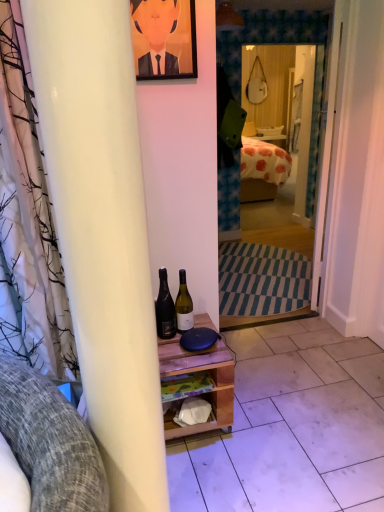
Question: Considering the relative sizes of wooden shelf at center, which is the first tile from left to right, and orange painted portrait at upper center in the image provided, is wooden shelf at center, which is the first tile from left to right, bigger than orange painted portrait at upper center?

Choices:
 (A) no
 (B) yes

Answer: (B)

Question: Is wooden shelf at center, arranged as the second tile when viewed from the right, with orange painted portrait at upper center?

Choices:
 (A) no
 (B) yes

Answer: (A)

Question: From a real-world perspective, is wooden shelf at center, arranged as the second tile when viewed from the right, positioned under orange painted portrait at upper center based on gravity?

Choices:
 (A) yes
 (B) no

Answer: (A)

Question: Can orange painted portrait at upper center be found inside wooden shelf at center, arranged as the second tile when viewed from the right?

Choices:
 (A) yes
 (B) no

Answer: (B)

Question: Does wooden shelf at center, arranged as the second tile when viewed from the right, have a greater width compared to orange painted portrait at upper center?

Choices:
 (A) no
 (B) yes

Answer: (B)

Question: Can you confirm if wooden shelf at center, arranged as the second tile when viewed from the right, is smaller than orange painted portrait at upper center?

Choices:
 (A) no
 (B) yes

Answer: (A)

Question: From a real-world perspective, is black glass bottle at center, which ranks as the second bottle in right-to-left order, located beneath orange painted portrait at upper center?

Choices:
 (A) no
 (B) yes

Answer: (B)

Question: Considering the relative sizes of black glass bottle at center, the 1th bottle from the left, and orange painted portrait at upper center in the image provided, is black glass bottle at center, the 1th bottle from the left, shorter than orange painted portrait at upper center?

Choices:
 (A) yes
 (B) no

Answer: (A)

Question: From the image's perspective, is black glass bottle at center, the 1th bottle from the left, above orange painted portrait at upper center?

Choices:
 (A) no
 (B) yes

Answer: (A)

Question: Is black glass bottle at center, the 1th bottle from the left, located outside orange painted portrait at upper center?

Choices:
 (A) no
 (B) yes

Answer: (B)

Question: Can you confirm if black glass bottle at center, the 1th bottle from the left, is wider than orange painted portrait at upper center?

Choices:
 (A) yes
 (B) no

Answer: (A)

Question: Is black glass bottle at center, which ranks as the second bottle in right-to-left order, oriented away from orange painted portrait at upper center?

Choices:
 (A) yes
 (B) no

Answer: (B)

Question: Does matte white mirror at center lie behind white wooden door at center?

Choices:
 (A) no
 (B) yes

Answer: (B)